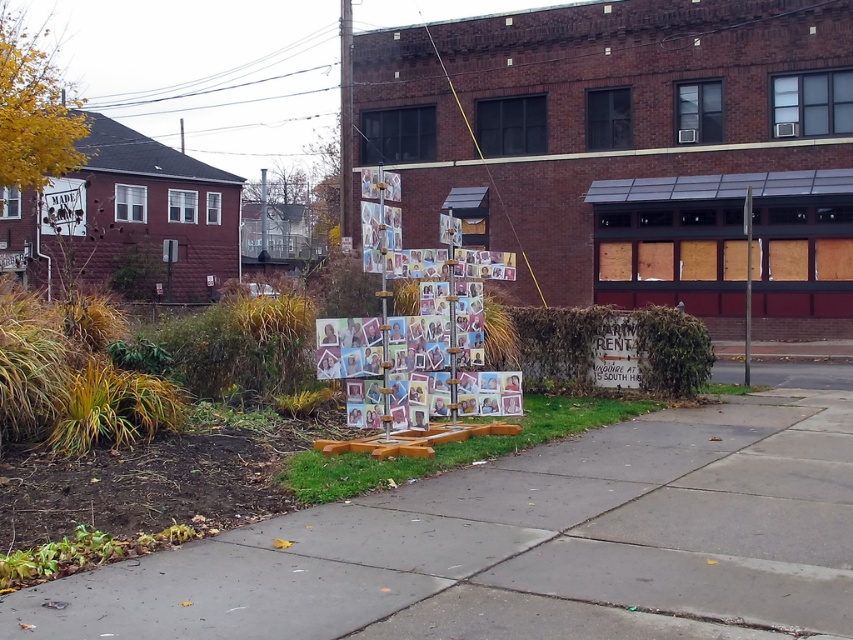
You are a pedestrian standing in front of the concrete sidewalk at center and the brushed metal sign at upper left. Which object is nearer to you?

The concrete sidewalk at center is closer to the viewer than the brushed metal sign at upper left.